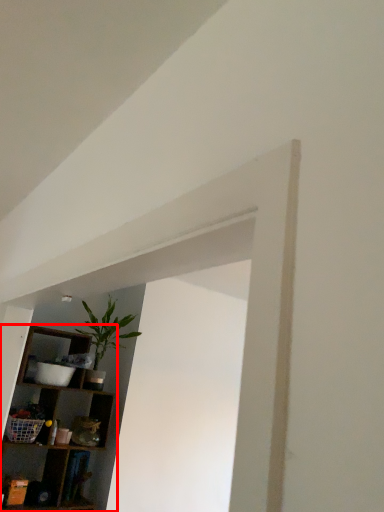
Question: Considering the relative positions of shelf (annotated by the red box) and houseplant in the image provided, where is shelf (annotated by the red box) located with respect to the staircase?

Choices:
 (A) right
 (B) left

Answer: (B)